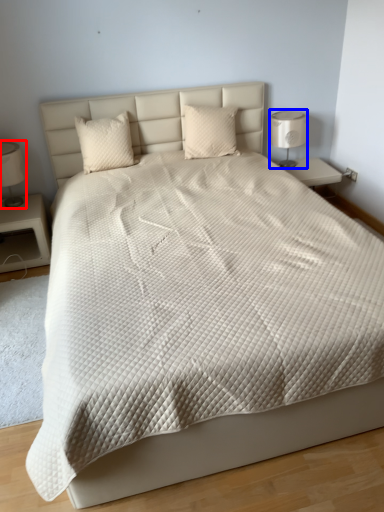
Question: Among these objects, which one is nearest to the camera, bedside lamp (highlighted by a red box) or bedside lamp (highlighted by a blue box)?

Choices:
 (A) bedside lamp
 (B) bedside lamp

Answer: (A)